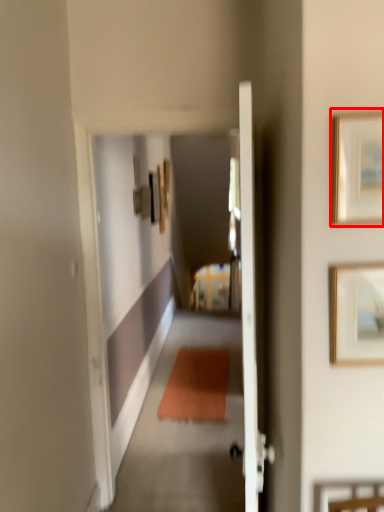
Question: From the image, what is the correct spatial relationship of picture frame (annotated by the red box) in relation to picture frame?

Choices:
 (A) right
 (B) left

Answer: (B)